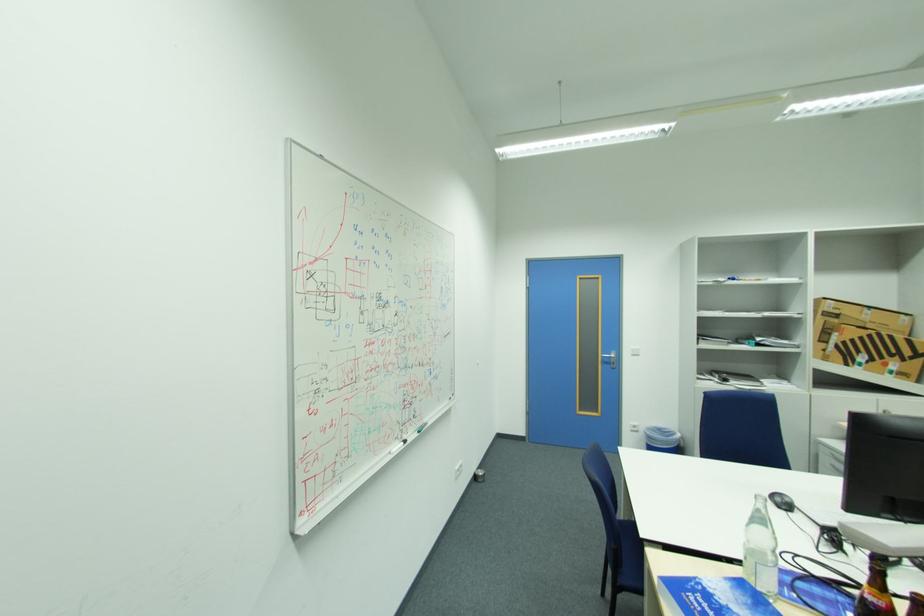
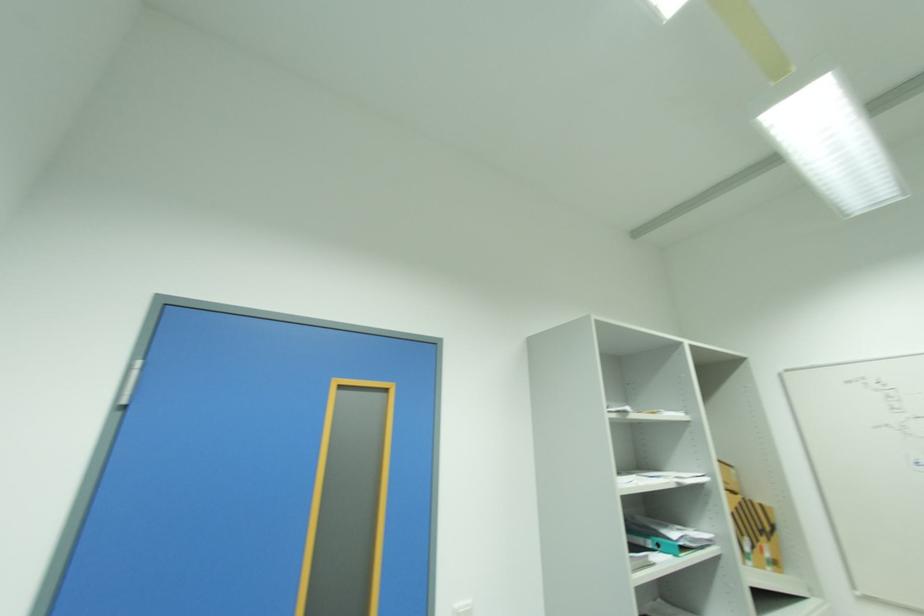
Where in the second image is the point corresponding to [638,349] from the first image?

(463, 604)